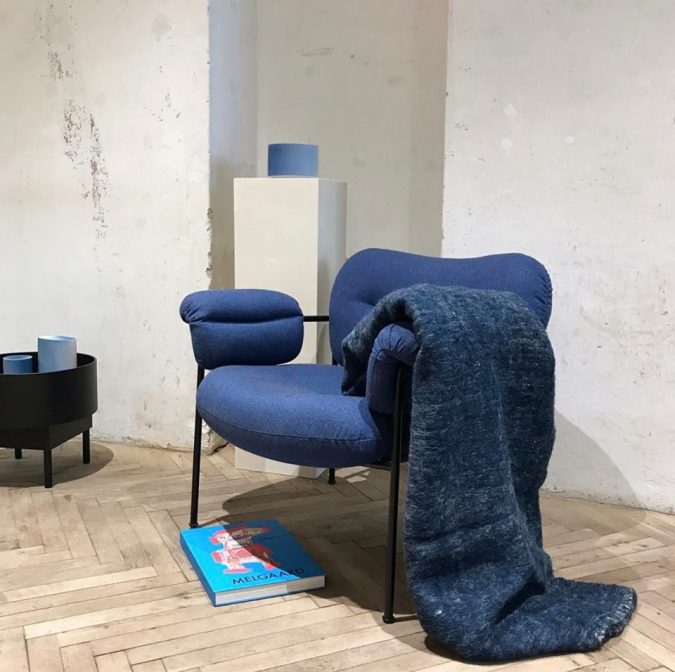
Find the location of a particular element. The width and height of the screenshot is (675, 672). book is located at coordinates (200, 546).